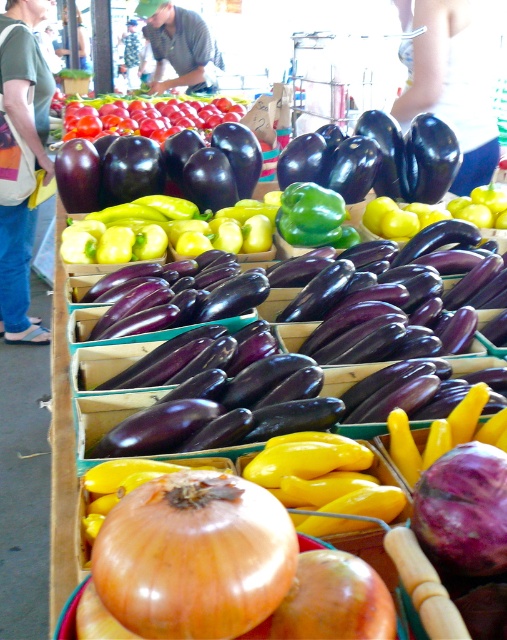
Question: Considering the relative positions of matte green shirt at upper left and gray cotton shirt at center in the image provided, where is matte green shirt at upper left located with respect to gray cotton shirt at center?

Choices:
 (A) right
 (B) left

Answer: (B)

Question: Estimate the real-world distances between objects in this image. Which object is closer to the smooth purple onion at center?

Choices:
 (A) matte green shirt at upper left
 (B) smooth orange onion at center
 (C) gray cotton shirt at center

Answer: (B)

Question: Which point is farther to the camera?

Choices:
 (A) (144, 19)
 (B) (197, 497)
 (C) (15, 204)
 (D) (438, 556)

Answer: (A)

Question: Is matte green shirt at upper left to the right of gray cotton shirt at center from the viewer's perspective?

Choices:
 (A) no
 (B) yes

Answer: (A)

Question: Which point is closer to the camera?

Choices:
 (A) (178, 17)
 (B) (497, 536)
 (C) (10, 275)

Answer: (B)

Question: Is smooth orange onion at center bigger than matte green shirt at upper left?

Choices:
 (A) no
 (B) yes

Answer: (A)